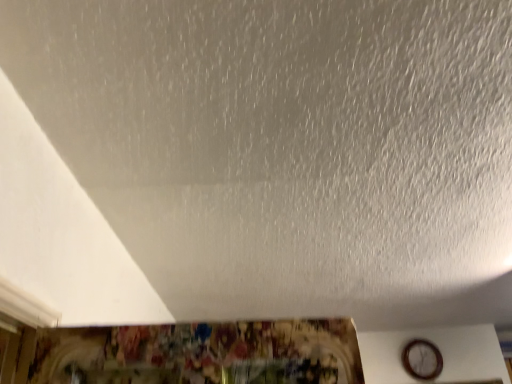
Question: Should I look upward or downward to see wooden clock at lower right?

Choices:
 (A) up
 (B) down

Answer: (B)